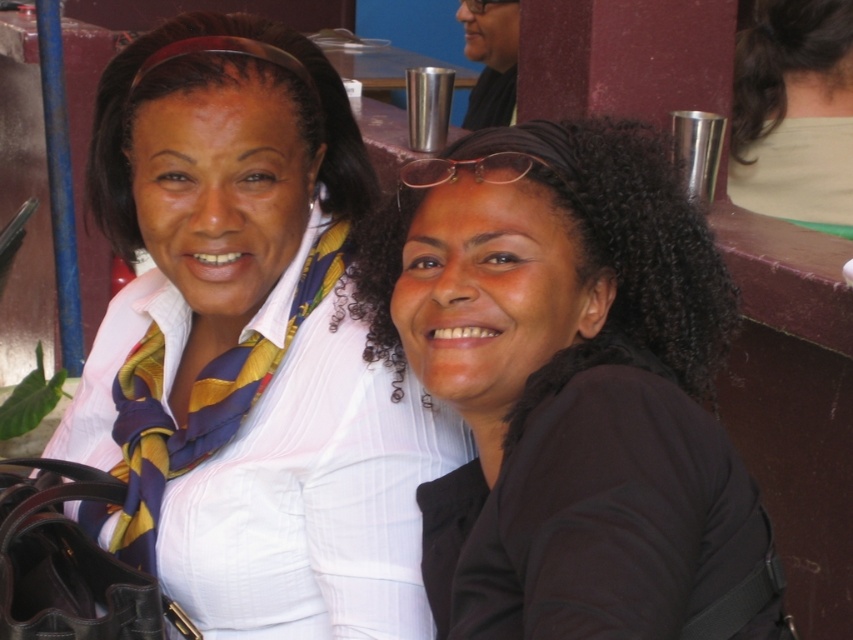
You are standing in front of the image and want to determine which of the two points, point (576,257) or point (838,156), is nearer to you. Based on the scene, which point is closer?

Point (576,257) is closer to the viewer than point (838,156).

From the picture: You are a photographer trying to adjust the lighting for a photo shoot. You notice the white striped shirt at center and the black matte hair at center. Which object is positioned to the left of the other?

The white striped shirt at center is to the left of the black matte hair at center.